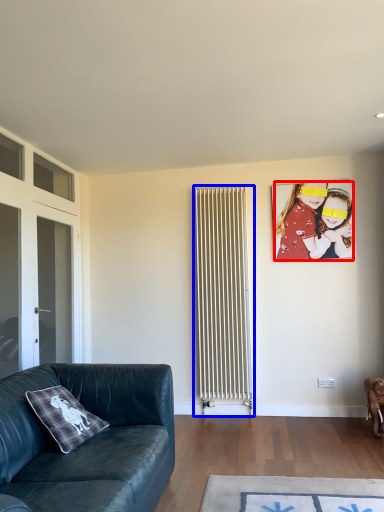
Question: Which object appears farthest to the camera in this image, person (highlighted by a red box) or radiator (highlighted by a blue box)?

Choices:
 (A) person
 (B) radiator

Answer: (A)